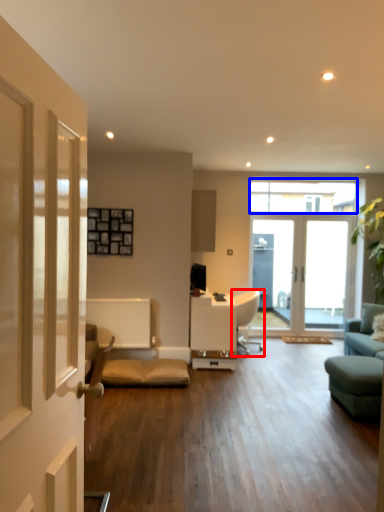
Question: Which object appears closest to the camera in this image, chair (highlighted by a red box) or window (highlighted by a blue box)?

Choices:
 (A) chair
 (B) window

Answer: (A)